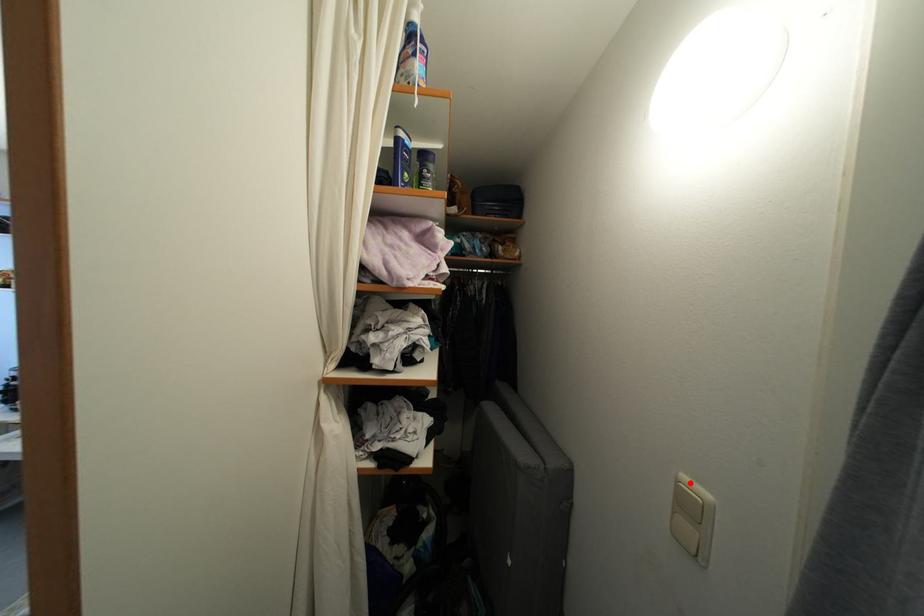
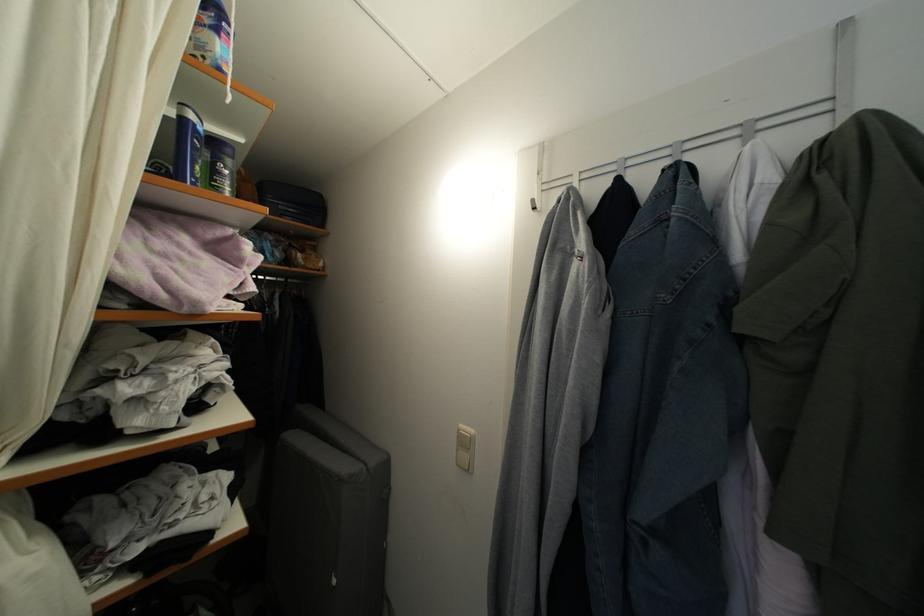
Where in the second image is the point corresponding to the highlighted location from the first image?

(467, 432)